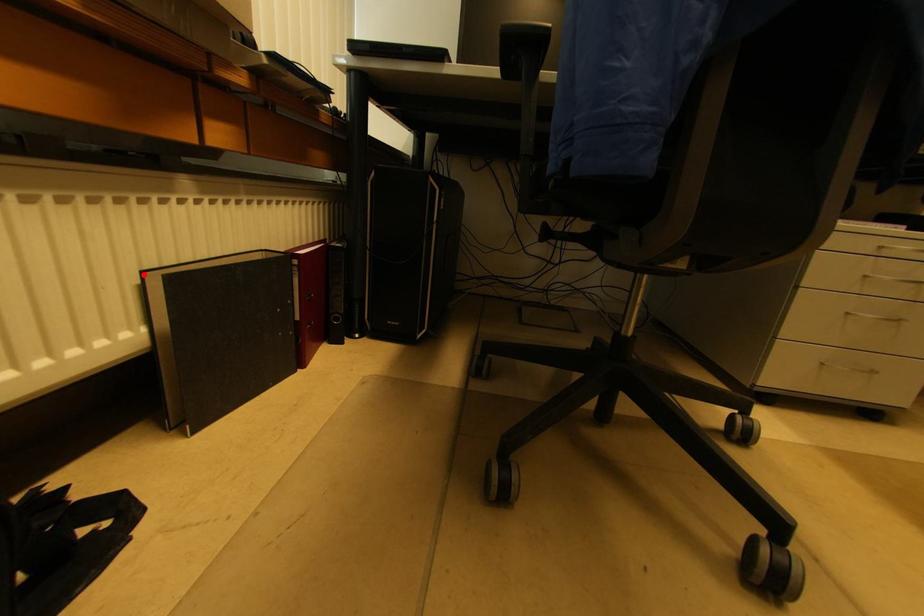
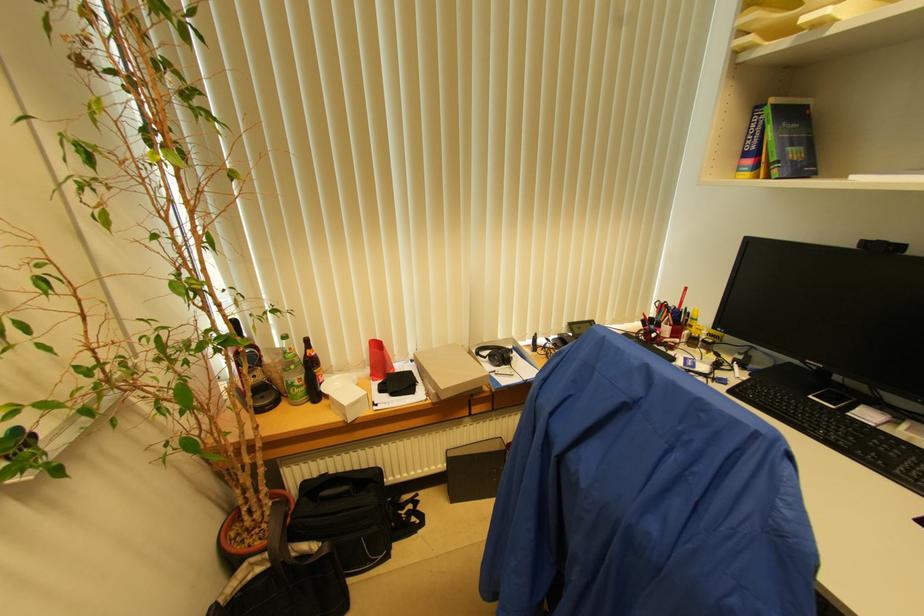
Question: I am providing you with two images of the same scene from different viewpoints. Given a red point in image1, look at the same physical point in image2. Is it:

Choices:
 (A) Closer to the viewpoint
 (B) Farther from the viewpoint

Answer: (B)